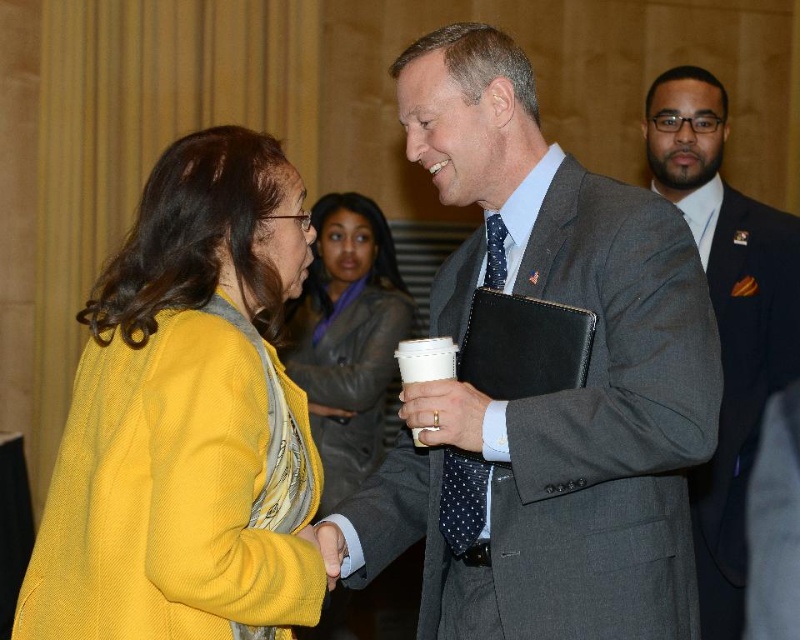
Based on the photo, you are organizing a photo shoot for a professional event and need to arrange two main subjects wearing the gray suit at center and the yellow corduroy jacket at center. Based on their heights, which subject should stand in front to ensure both are visible in the photo?

The gray suit at center is shorter than the yellow corduroy jacket at center, so the shorter person in the gray suit at center should stand in front to ensure both are visible in the photo.

You are an event planner organizing a formal event. You need to ensure that all guests are properly positioned according to their attire. The dark gray suit at right and the polka dot silk tie at center are in your line of sight. Which attire is closer to you?

The dark gray suit at right is closer to you because the polka dot silk tie at center is behind it.

Based on the photo, you are standing in the center of the image and want to hand a document to the person wearing the yellow corduroy jacket at left. In which direction should you move to approach them?

The yellow corduroy jacket at left is located at point 0.656 on the x and 0.234 on the y coordinate. Since you are in the center, you should move to the left and slightly downward to reach them.